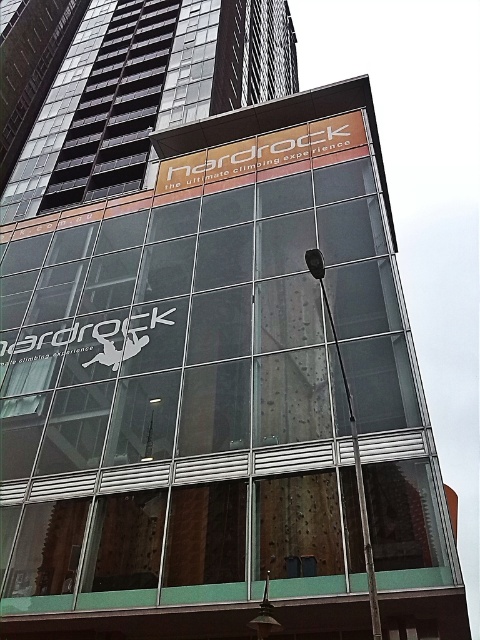
Can you confirm if orange matte sign at upper center is smaller than black metallic pole at upper center?

Incorrect, orange matte sign at upper center is not smaller in size than black metallic pole at upper center.

Is point (230, 156) closer to camera compared to point (309, 269)?

No, (230, 156) is behind (309, 269).

Between point (252, 145) and point (362, 540), which one is positioned behind?

The point (252, 145) is more distant.

I want to click on orange matte sign at upper center, so click(x=262, y=152).